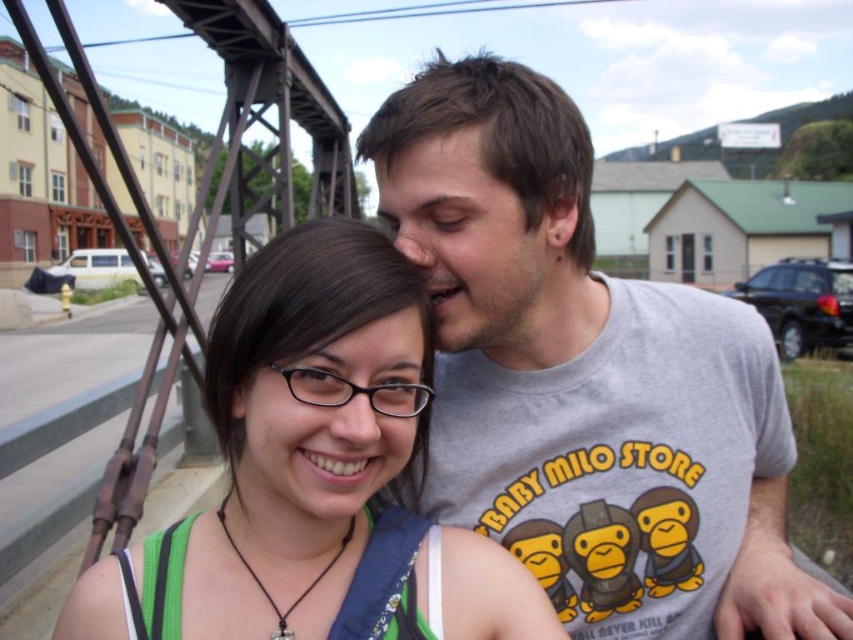
From the picture: Measure the distance from gray cotton t-shirt at upper right to green fabric at center.

The distance of gray cotton t-shirt at upper right from green fabric at center is 12.92 inches.

The image size is (853, 640). I want to click on gray cotton t-shirt at upper right, so click(x=585, y=380).